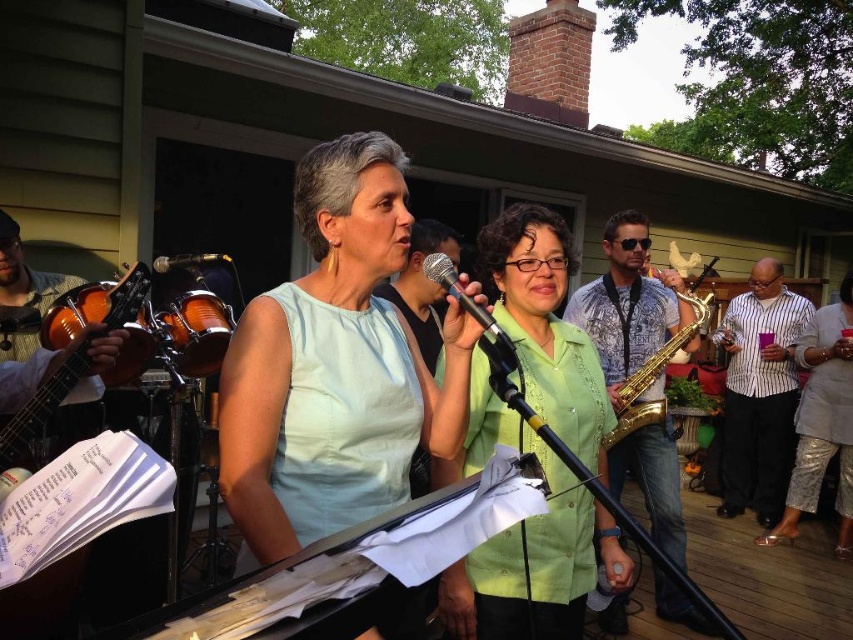
What is located at the coordinates point [525,541]?

The green matte shirt at center is located at point [525,541].

Based on the photo, you are standing in front of the musical performance scene. There are two points marked in the image. The first point is at coordinates point (67, 314) and the second point is at point (724, 344). Which point is closer to you?

Point (67, 314) is closer to the viewer than point (724, 344).

Consider the image. You are a photographer trying to capture the performer with the green matte shirt at center and the black metallic microphone at center. Which object should you focus on first if you want to ensure both are in the frame?

The green matte shirt at center is positioned on the right side of black metallic microphone at center, so you should focus on the black metallic microphone at center first to ensure both are in the frame.